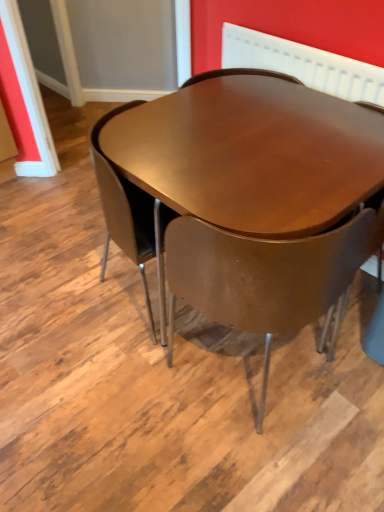
Image resolution: width=384 pixels, height=512 pixels. I want to click on vacant region above shiny brown table at center (from a real-world perspective), so [256, 133].